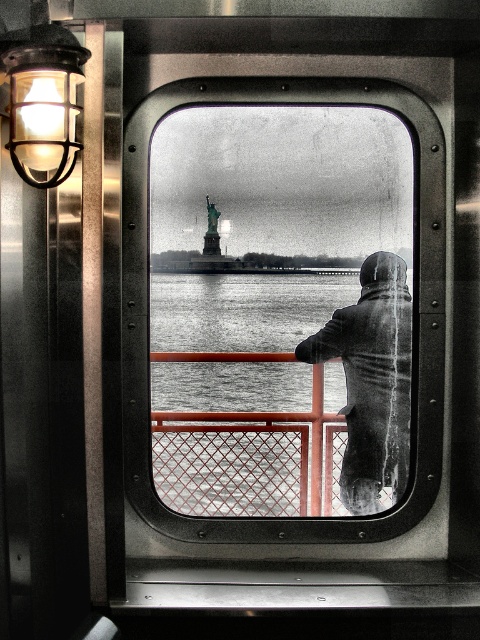
Question: Based on their relative distances, which object is nearer to the metallic glass window at center?

Choices:
 (A) matte black light fixture at upper left
 (B) gray woolen coat at center

Answer: (A)

Question: Which point is farther to the camera?

Choices:
 (A) (194, 547)
 (B) (34, 179)
 (C) (371, 413)

Answer: (C)

Question: Estimate the real-world distances between objects in this image. Which object is closer to the metallic glass window at center?

Choices:
 (A) matte black light fixture at upper left
 (B) gray woolen coat at center

Answer: (A)

Question: Is metallic glass window at center to the left of gray woolen coat at center from the viewer's perspective?

Choices:
 (A) no
 (B) yes

Answer: (B)

Question: Can you confirm if gray woolen coat at center is positioned below matte black light fixture at upper left?

Choices:
 (A) no
 (B) yes

Answer: (B)

Question: Can you confirm if metallic glass window at center is positioned to the left of gray woolen coat at center?

Choices:
 (A) no
 (B) yes

Answer: (B)